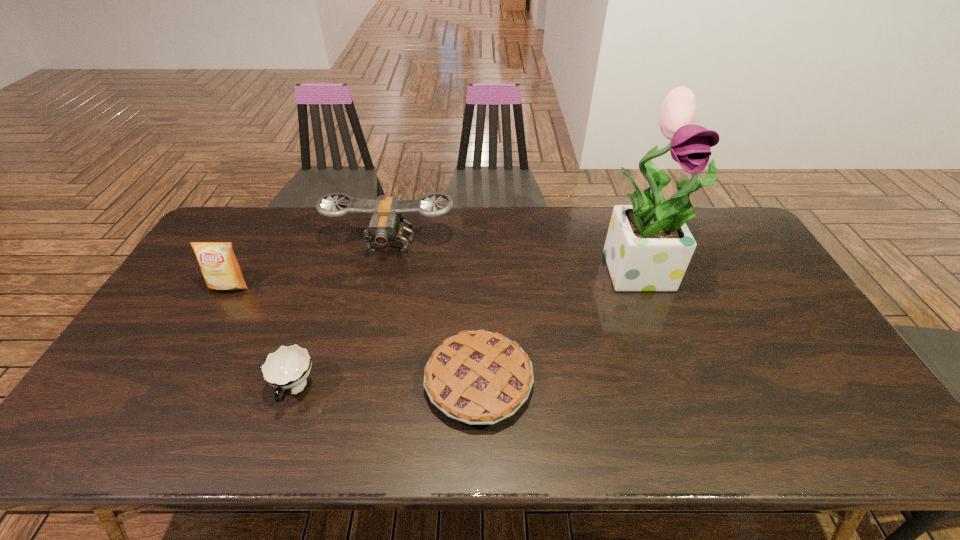
At what (x,y) coordinates should I click in order to perform the action: click on vacant space located on the right of the shortest object. Please return your answer as a coordinate pair (x, y). The height and width of the screenshot is (540, 960). Looking at the image, I should click on (648, 382).

Identify the location of flower arrangement present at the far edge. (648, 247).

Identify the location of drone present at the far edge. (386, 225).

Where is `cup positioned at the near edge`? cup positioned at the near edge is located at coordinates (287, 368).

I want to click on pie present at the near edge, so click(478, 377).

Identify the location of object positioned at the left edge. The image size is (960, 540). (219, 266).

Find the location of a particular element. vacant space at the far edge is located at coordinates (350, 241).

Locate an element on the screen. This screenshot has height=540, width=960. vacant area at the near edge is located at coordinates (740, 435).

At what (x,y) coordinates should I click in order to perform the action: click on blank space at the left edge. Please return your answer as a coordinate pair (x, y). The height and width of the screenshot is (540, 960). Looking at the image, I should click on (160, 347).

Image resolution: width=960 pixels, height=540 pixels. What are the coordinates of `blank space at the right edge of the desktop` in the screenshot? It's located at (732, 271).